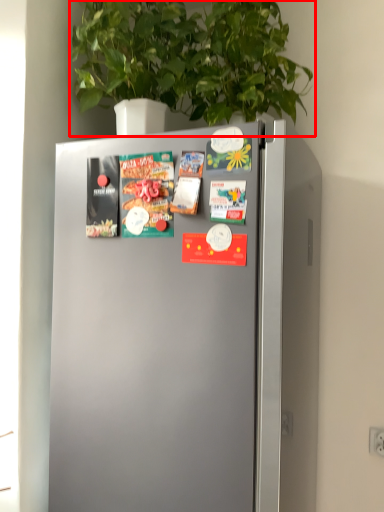
Question: Considering the relative positions of houseplant (annotated by the red box) and magazine in the image provided, where is houseplant (annotated by the red box) located with respect to the staircase?

Choices:
 (A) right
 (B) left

Answer: (A)